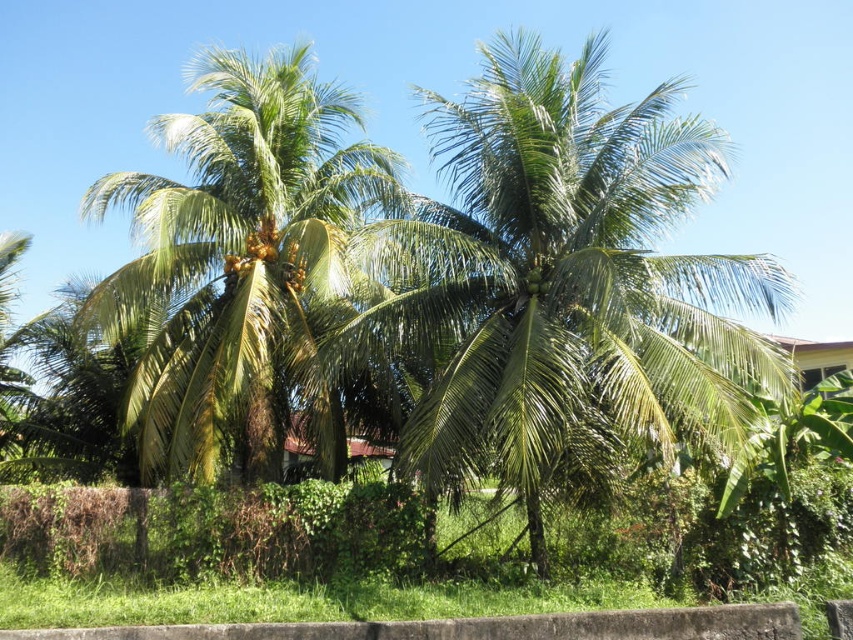
You are standing in front of the tropical scene and want to place a small statue between the green leafy coconut tree at center and the green leafy coconut tree at left. Based on their positions, which tree should the statue be closer to if it needs to be placed at a lower elevation?

The statue should be placed closer to the green leafy coconut tree at left because the green leafy coconut tree at center is above it, meaning the left tree is positioned lower.

You are a botanist examining two coconut trees in a tropical setting. You notice the green leafy coconut tree at center and the green leafy coconut tree at left. Which of these two trees is larger in size?

The green leafy coconut tree at center is bigger than the green leafy coconut tree at left according to the description provided.

You are standing in front of the low concrete wall in the tropical scene. You want to know which coconut tree is taller. Based on the scene, can you determine which one is taller between the green leafy coconut tree at center and the green leafy coconut tree at left?

The green leafy coconut tree at center is much taller than the green leafy coconut tree at left.